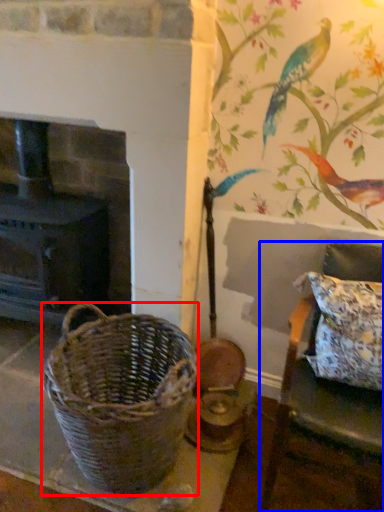
Question: Which of the following is the closest to the observer, picnic basket (highlighted by a red box) or furniture (highlighted by a blue box)?

Choices:
 (A) picnic basket
 (B) furniture

Answer: (B)